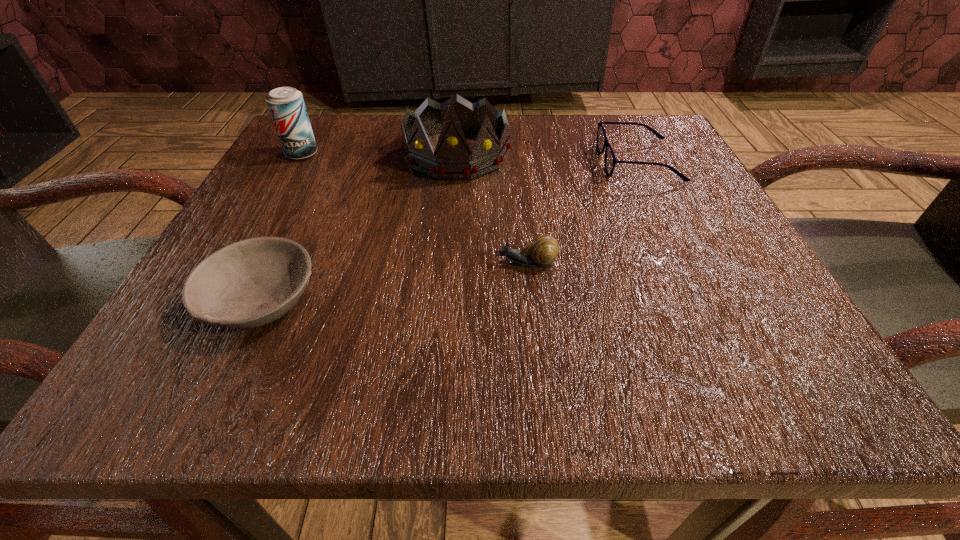
Find the location of a particular element. blank region between the spectacles and the escargot is located at coordinates (582, 213).

This screenshot has height=540, width=960. In order to click on object that can be found as the closest to the tallest object in this screenshot , I will do `click(286, 105)`.

This screenshot has width=960, height=540. In order to click on object that is the second closest to the spectacles in this screenshot , I will do `click(543, 250)`.